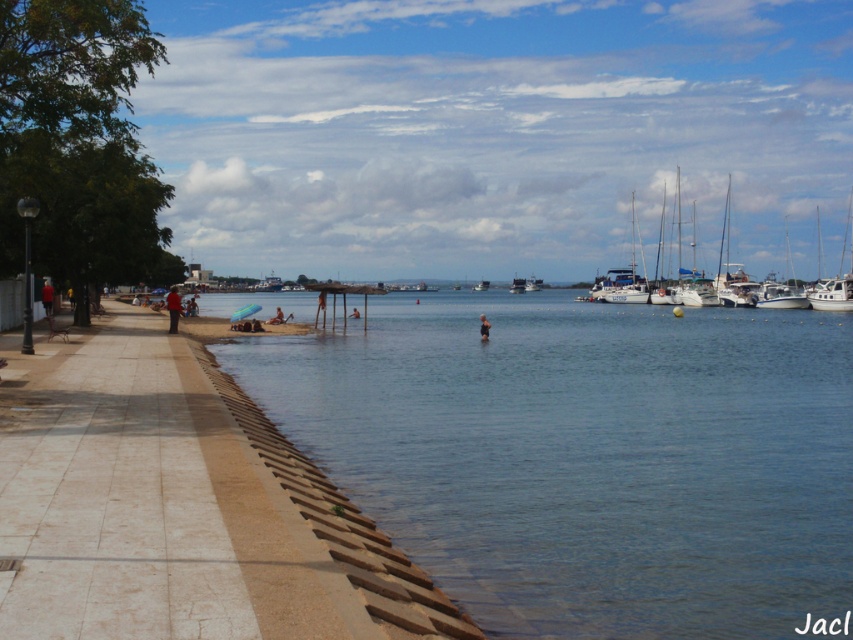
Question: Does white matte boats at right come behind dark red shirt at left?

Choices:
 (A) no
 (B) yes

Answer: (B)

Question: Is clear blue water at lower left in front of white glossy boat at center?

Choices:
 (A) no
 (B) yes

Answer: (B)

Question: Which object appears closest to the camera in this image?

Choices:
 (A) dark red shirt at left
 (B) light blue fabric person at lower center
 (C) skinny person at center

Answer: (A)

Question: Which object is farther from the camera taking this photo?

Choices:
 (A) white glossy sailboat at upper right
 (B) dark blue shirt at left

Answer: (A)

Question: Which point is closer to the camera?

Choices:
 (A) white matte boats at right
 (B) light blue fabric person at lower center

Answer: (B)

Question: Can you confirm if dark blue shirt at left is positioned to the left of dark red shirt at left?

Choices:
 (A) no
 (B) yes

Answer: (B)